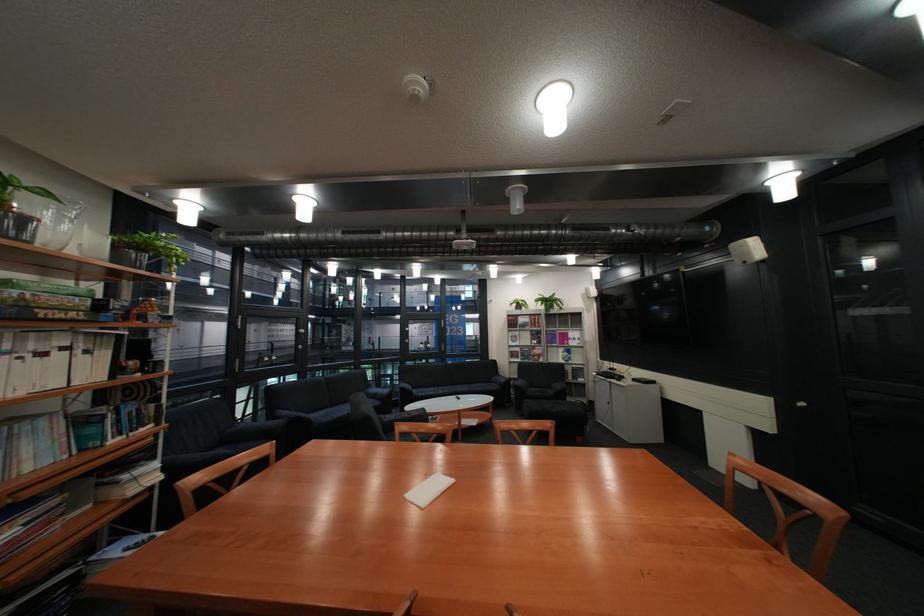
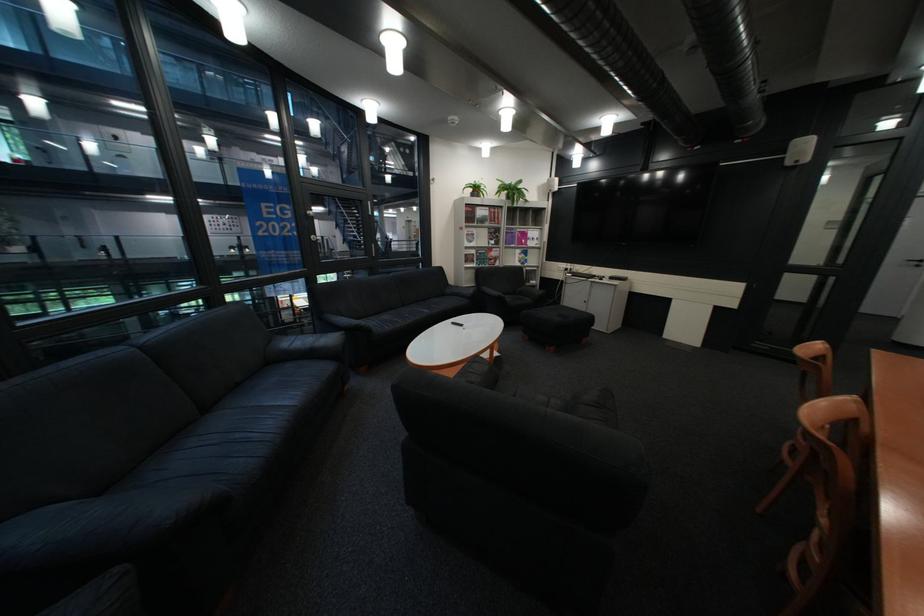
Locate, in the second image, the point that corresponds to pixel 524 315 in the first image.

(481, 205)